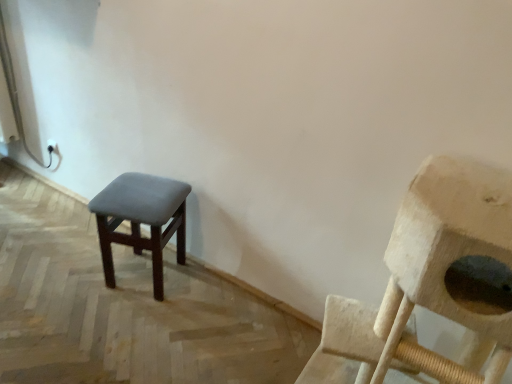
This screenshot has height=384, width=512. I want to click on vacant space that is to the left of dark gray fabric stool at left, so click(76, 273).